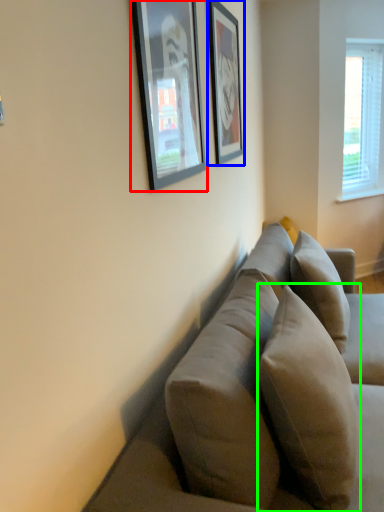
Question: Which is farther away from picture frame (highlighted by a red box)? picture frame (highlighted by a blue box) or pillow (highlighted by a green box)?

Choices:
 (A) picture frame
 (B) pillow

Answer: (B)